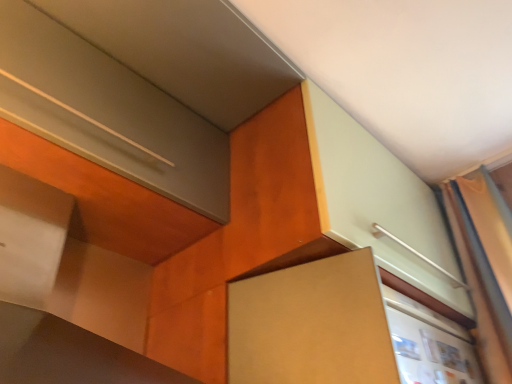
Image resolution: width=512 pixels, height=384 pixels. Describe the element at coordinates (311, 324) in the screenshot. I see `brown matte cabinet at center` at that location.

Measure the distance between point (321, 329) and camera.

Point (321, 329) and camera are 81.70 centimeters apart from each other.

What is the approximate width of brown matte cabinet at center?

brown matte cabinet at center is 12.82 inches in width.

Image resolution: width=512 pixels, height=384 pixels. Identify the location of brown matte cabinet at center. (311, 324).

What do you see at coordinates (484, 268) in the screenshot? This screenshot has width=512, height=384. I see `silky orange curtain at right` at bounding box center [484, 268].

Where is `silky orange curtain at right`? The width and height of the screenshot is (512, 384). silky orange curtain at right is located at coordinates (484, 268).

In order to face silky orange curtain at right, should I rotate leftwards or rightwards?

Turn right by 28.968 degrees to look at silky orange curtain at right.

You are a GUI agent. You are given a task and a screenshot of the screen. Output one action in this format:
    pyautogui.click(x=<x>, y=<y>)
    Task: Click on the brown matte cabinet at center
    
    Given the screenshot: What is the action you would take?
    pyautogui.click(x=311, y=324)

Is brown matte cabinet at center to the left of silky orange curtain at right from the viewer's perspective?

Correct, you'll find brown matte cabinet at center to the left of silky orange curtain at right.

Between brown matte cabinet at center and silky orange curtain at right, which one is positioned in front?

brown matte cabinet at center is in front.

Is point (267, 309) farther from viewer compared to point (466, 206)?

No.

From the image's perspective, between brown matte cabinet at center and silky orange curtain at right, who is located below?

brown matte cabinet at center appears lower in the image.

From a real-world perspective, is brown matte cabinet at center physically above silky orange curtain at right?

No.

Considering the relative sizes of brown matte cabinet at center and silky orange curtain at right in the image provided, is brown matte cabinet at center wider than silky orange curtain at right?

Indeed, brown matte cabinet at center has a greater width compared to silky orange curtain at right.

Considering the sizes of objects brown matte cabinet at center and silky orange curtain at right in the image provided, who is shorter, brown matte cabinet at center or silky orange curtain at right?

With less height is brown matte cabinet at center.

Between brown matte cabinet at center and silky orange curtain at right, which one has larger size?

silky orange curtain at right.

Can we say brown matte cabinet at center lies outside silky orange curtain at right?

brown matte cabinet at center lies outside silky orange curtain at right's area.

Is brown matte cabinet at center next to silky orange curtain at right?

No.

Could you tell me if brown matte cabinet at center is facing silky orange curtain at right?

No, brown matte cabinet at center is not aimed at silky orange curtain at right.

Identify the location of cabinetry below the silky orange curtain at right (from the image's perspective). Image resolution: width=512 pixels, height=384 pixels. (311, 324).

Is silky orange curtain at right at the left side of brown matte cabinet at center?

No.

Is the depth of silky orange curtain at right less than that of brown matte cabinet at center?

No, it is not.

Does point (485, 347) come behind point (317, 358)?

Yes.

From the image's perspective, which is below, silky orange curtain at right or brown matte cabinet at center?

brown matte cabinet at center is shown below in the image.

From a real-world perspective, between silky orange curtain at right and brown matte cabinet at center, who is vertically higher?

From a 3D spatial view, silky orange curtain at right is above.

Considering the relative sizes of silky orange curtain at right and brown matte cabinet at center in the image provided, is silky orange curtain at right wider than brown matte cabinet at center?

Incorrect, the width of silky orange curtain at right does not surpass that of brown matte cabinet at center.

Considering the sizes of objects silky orange curtain at right and brown matte cabinet at center in the image provided, who is shorter, silky orange curtain at right or brown matte cabinet at center?

With less height is brown matte cabinet at center.

Who is bigger, silky orange curtain at right or brown matte cabinet at center?

silky orange curtain at right is bigger.

In the scene shown: Can brown matte cabinet at center be found inside silky orange curtain at right?

No, brown matte cabinet at center is not a part of silky orange curtain at right.

Is silky orange curtain at right next to brown matte cabinet at center and touching it?

No, silky orange curtain at right is not in contact with brown matte cabinet at center.

Is brown matte cabinet at center at the back of silky orange curtain at right?

No, brown matte cabinet at center is not at the back of silky orange curtain at right.

Consider the image. How different are the orientations of silky orange curtain at right and brown matte cabinet at center in degrees?

They differ by 102 degrees in their facing directions.

Where is `cabinetry below the silky orange curtain at right (from a real-world perspective)`? The height and width of the screenshot is (384, 512). cabinetry below the silky orange curtain at right (from a real-world perspective) is located at coordinates (311, 324).

What are the coordinates of `cabinetry located below the silky orange curtain at right (from the image's perspective)` in the screenshot? It's located at (311, 324).

At what (x,y) coordinates should I click in order to perform the action: click on curtain that is behind the brown matte cabinet at center. Please return your answer as a coordinate pair (x, y). This screenshot has width=512, height=384. Looking at the image, I should click on (484, 268).